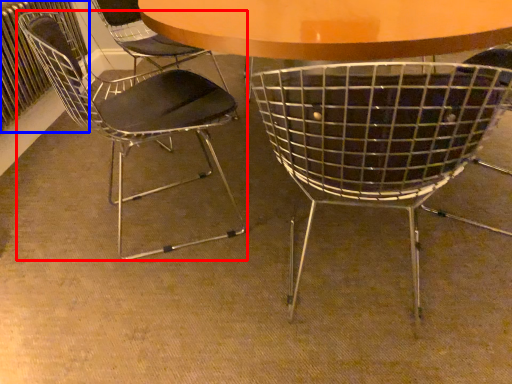
Question: Which object appears farthest to the camera in this image, chair (highlighted by a red box) or radiator (highlighted by a blue box)?

Choices:
 (A) chair
 (B) radiator

Answer: (B)